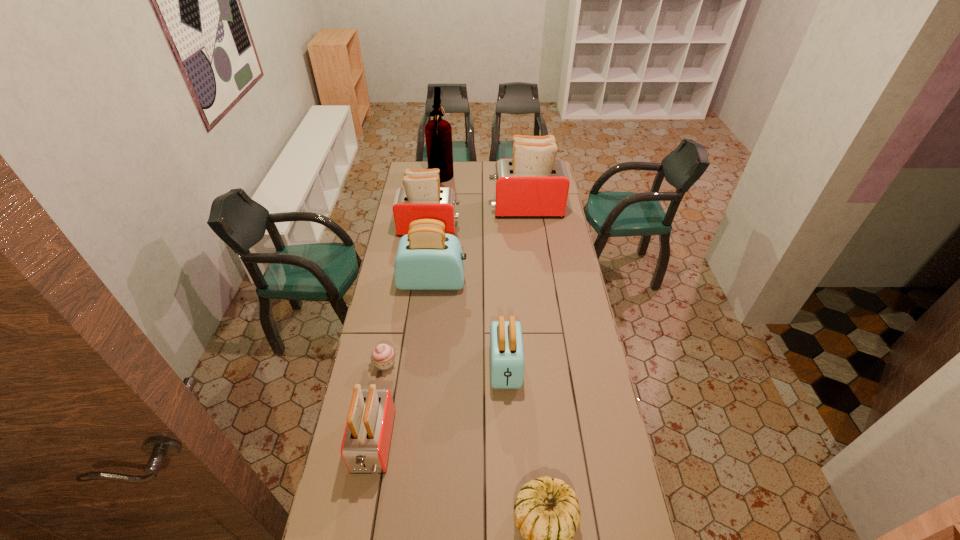
Identify which red toaster is the second nearest to the fourth farthest toaster. Please provide its 2D coordinates. Your answer should be formatted as a tuple, i.e. [(x, y)], where the tuple contains the x and y coordinates of a point satisfying the conditions above.

[(421, 197)]

Where is `red toaster that can be found as the closest to the fourth farthest object`? The image size is (960, 540). red toaster that can be found as the closest to the fourth farthest object is located at coordinates 421,197.

Locate an element on the screen. This screenshot has height=540, width=960. vacant space that satisfies the following two spatial constraints: 1. on the front-facing side of the second tallest object; 2. on the side of the fourth farthest toaster with the lever is located at coordinates (545, 367).

At what (x,y) coordinates should I click in order to perform the action: click on blank area in the image that satisfies the following two spatial constraints: 1. on the front-facing side of the second biggest red toaster; 2. on the front-facing side of the smallest red toaster. Please return your answer as a coordinate pair (x, y). This screenshot has height=540, width=960. Looking at the image, I should click on (401, 443).

Identify the location of free location that satisfies the following two spatial constraints: 1. at the nozzle of the red fire extinguisher; 2. on the front side of the shortest object. The image size is (960, 540). (420, 363).